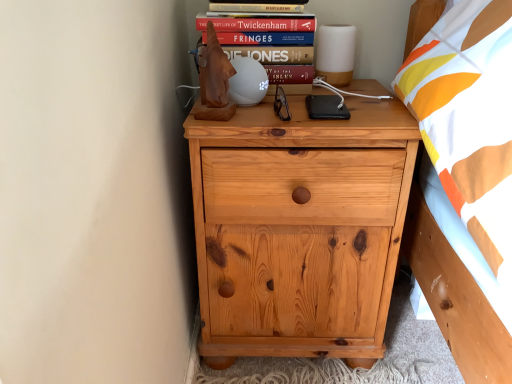
Question: From a real-world perspective, is natural wood chest of drawers at center positioned over hardcover book at upper center based on gravity?

Choices:
 (A) yes
 (B) no

Answer: (B)

Question: Can you confirm if natural wood chest of drawers at center is shorter than hardcover book at upper center?

Choices:
 (A) yes
 (B) no

Answer: (B)

Question: Is natural wood chest of drawers at center further to the viewer compared to hardcover book at upper center?

Choices:
 (A) yes
 (B) no

Answer: (B)

Question: Is natural wood chest of drawers at center turned away from hardcover book at upper center?

Choices:
 (A) no
 (B) yes

Answer: (A)

Question: Does natural wood chest of drawers at center touch hardcover book at upper center?

Choices:
 (A) yes
 (B) no

Answer: (B)

Question: Is natural wood chest of drawers at center outside of hardcover book at upper center?

Choices:
 (A) no
 (B) yes

Answer: (B)

Question: Can you confirm if hardcover book at upper center is taller than natural wood chest of drawers at center?

Choices:
 (A) yes
 (B) no

Answer: (B)

Question: Does hardcover book at upper center appear on the left side of natural wood chest of drawers at center?

Choices:
 (A) no
 (B) yes

Answer: (B)

Question: Can you confirm if hardcover book at upper center is smaller than natural wood chest of drawers at center?

Choices:
 (A) yes
 (B) no

Answer: (A)

Question: Could natural wood chest of drawers at center be considered to be inside hardcover book at upper center?

Choices:
 (A) yes
 (B) no

Answer: (B)

Question: Is hardcover book at upper center wider than natural wood chest of drawers at center?

Choices:
 (A) no
 (B) yes

Answer: (A)

Question: Considering the relative sizes of hardcover book at upper center and natural wood chest of drawers at center in the image provided, is hardcover book at upper center thinner than natural wood chest of drawers at center?

Choices:
 (A) no
 (B) yes

Answer: (B)

Question: Is hardcover book at upper center facing towards natural wood chest of drawers at center?

Choices:
 (A) no
 (B) yes

Answer: (A)